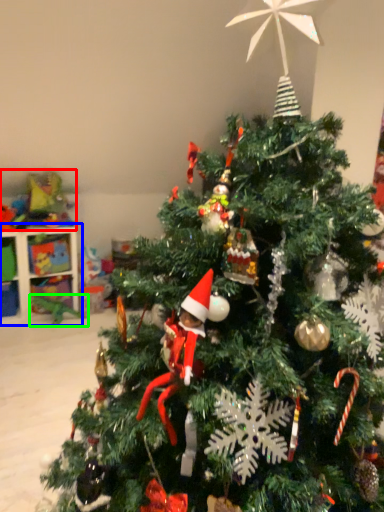
Question: Estimate the real-world distances between objects in this image. Which object is closer to toy (highlighted by a red box), shelf (highlighted by a blue box) or toy (highlighted by a green box)?

Choices:
 (A) shelf
 (B) toy

Answer: (A)